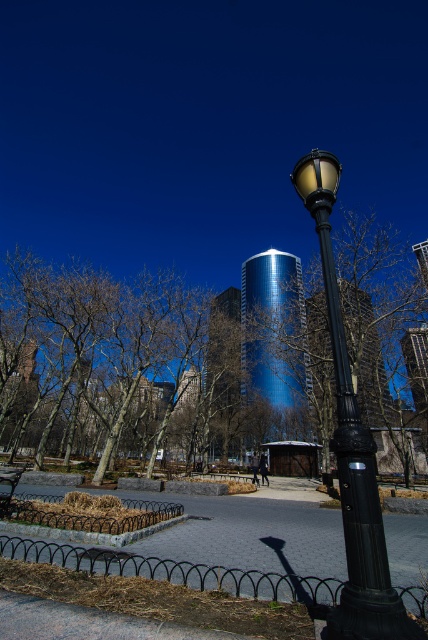
Is bare branches at center taller than wooden park bench at lower left?

Correct, bare branches at center is much taller as wooden park bench at lower left.

Is bare branches at center smaller than wooden park bench at lower left?

No, bare branches at center is not smaller than wooden park bench at lower left.

I want to click on bare branches at center, so click(x=371, y=307).

Looking at this image, can you confirm if black polished metal street light at right is thinner than wooden park bench at lower left?

Yes.

Does black polished metal street light at right have a lesser height compared to wooden park bench at lower left?

No, black polished metal street light at right is not shorter than wooden park bench at lower left.

Image resolution: width=428 pixels, height=640 pixels. I want to click on black polished metal street light at right, so click(x=351, y=449).

Between black polished metal street light at right and bare branches at center, which one is positioned lower?

black polished metal street light at right is lower down.

Which is above, black polished metal street light at right or bare branches at center?

bare branches at center is higher up.

Where is `black polished metal street light at right`? This screenshot has width=428, height=640. black polished metal street light at right is located at coordinates (351, 449).